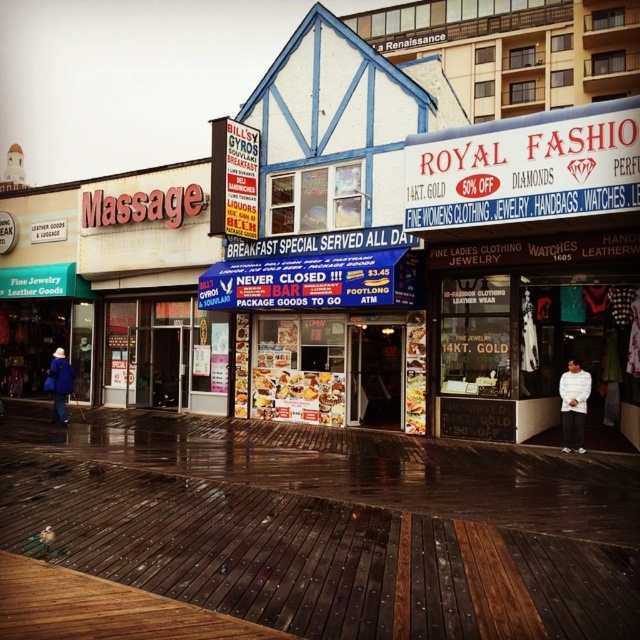
Looking at this image, you are standing on the boardwalk and want to take a photo of the two points marked in the scene. Which point, point 1 at coordinates (582, 385) or point 2 at (54, 378), will appear larger in your camera view?

Answer: Point 1 at coordinates (582, 385) will appear larger in the camera view because it is closer to the camera than point 2 at (54, 378).

You are a food delivery person who needs to place an order of golden crispy fries at center and a white fabric shirt at lower right into a small delivery box. The box can only accommodate items that are narrower than 15 centimeters. Based on the scene, can both items fit side by side in the box?

The golden crispy fries at center might be wider than white fabric shirt at lower right. Since the fries could be wider than 15 centimeters, it is uncertain if both items can fit side by side in the box without exceeding the width limit.